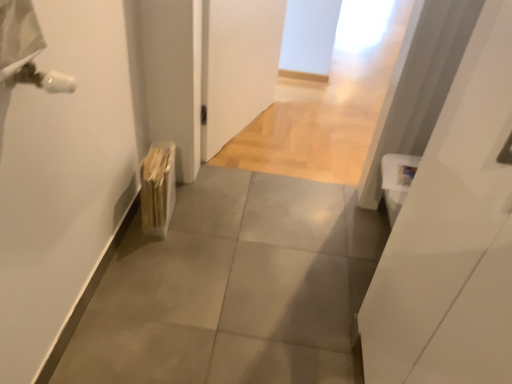
In order to click on wooden radiator at lower left in this screenshot , I will do `click(158, 189)`.

Describe the element at coordinates (234, 288) in the screenshot. I see `gray tile floor at center` at that location.

Identify the location of wooden radiator at lower left. This screenshot has height=384, width=512. pyautogui.click(x=158, y=189).

Is gray tile floor at center smaller than wooden radiator at lower left?

Incorrect, gray tile floor at center is not smaller in size than wooden radiator at lower left.

Considering the sizes of objects gray tile floor at center and wooden radiator at lower left in the image provided, who is thinner, gray tile floor at center or wooden radiator at lower left?

wooden radiator at lower left.

Based on the photo, is there a large distance between gray tile floor at center and wooden radiator at lower left?

They are positioned close to each other.

Considering the positions of objects gray tile floor at center and wooden radiator at lower left in the image provided, who is more to the right, gray tile floor at center or wooden radiator at lower left?

From the viewer's perspective, gray tile floor at center appears more on the right side.

Locate an element on the screen. This screenshot has height=384, width=512. door that is on the right side of wooden radiator at lower left is located at coordinates (453, 236).

Is white glossy door at right far from wooden radiator at lower left?

Absolutely, white glossy door at right is distant from wooden radiator at lower left.

Between point (435, 190) and point (165, 229), which one is positioned in front?

The point (435, 190) is closer.

From a real-world perspective, which object rests below the other?

wooden radiator at lower left, from a real-world perspective.

How much distance is there between gray tile floor at center and white glossy door at right?

The distance of gray tile floor at center from white glossy door at right is 23.75 inches.

Would you say gray tile floor at center is to the left or to the right of white glossy door at right in the picture?

In the image, gray tile floor at center appears on the left side of white glossy door at right.

Could you tell me if gray tile floor at center is facing white glossy door at right?

No, gray tile floor at center is not aimed at white glossy door at right.

From a real-world perspective, is gray tile floor at center physically located above or below white glossy door at right?

In terms of real-world spatial position, gray tile floor at center is below white glossy door at right.

Based on their positions, is wooden radiator at lower left located to the left or right of white glossy door at right?

Clearly, wooden radiator at lower left is on the left of white glossy door at right in the image.

From the picture: Can you confirm if wooden radiator at lower left is shorter than white glossy door at right?

Yes, wooden radiator at lower left is shorter than white glossy door at right.

Find the location of `door above the wooden radiator at lower left (from a real-world perspective)`. door above the wooden radiator at lower left (from a real-world perspective) is located at coordinates (x=453, y=236).

Is wooden radiator at lower left not inside white glossy door at right?

wooden radiator at lower left lies outside white glossy door at right's area.

Is wooden radiator at lower left in contact with gray tile floor at center?

No.

Where is `concrete below the wooden radiator at lower left (from a real-world perspective)`? concrete below the wooden radiator at lower left (from a real-world perspective) is located at coordinates (234, 288).

Do you think wooden radiator at lower left is within gray tile floor at center, or outside of it?

wooden radiator at lower left is spatially situated outside gray tile floor at center.

Does white glossy door at right have a smaller size compared to gray tile floor at center?

Yes, white glossy door at right is smaller than gray tile floor at center.

From a real-world perspective, who is located higher, white glossy door at right or gray tile floor at center?

From a 3D spatial view, white glossy door at right is above.

The image size is (512, 384). There is a gray tile floor at center. Identify the location of door above it (from a real-world perspective). (453, 236).

Between white glossy door at right and gray tile floor at center, which one has more height?

white glossy door at right.

The width and height of the screenshot is (512, 384). Identify the location of concrete that is below the wooden radiator at lower left (from the image's perspective). (234, 288).

At what (x,y) coordinates should I click in order to perform the action: click on door that appears above the wooden radiator at lower left (from a real-world perspective). Please return your answer as a coordinate pair (x, y). The image size is (512, 384). Looking at the image, I should click on (453, 236).

Estimate the real-world distances between objects in this image. Which object is closer to wooden radiator at lower left, gray tile floor at center or white glossy door at right?

gray tile floor at center lies closer to wooden radiator at lower left than the other object.

Looking at the image, which one is located further to gray tile floor at center, wooden radiator at lower left or white glossy door at right?

Among the two, white glossy door at right is located further to gray tile floor at center.

Considering their positions, is gray tile floor at center positioned closer to white glossy door at right than wooden radiator at lower left?

The object closer to white glossy door at right is gray tile floor at center.

From the image, which object appears to be farther from gray tile floor at center, white glossy door at right or wooden radiator at lower left?

Among the two, white glossy door at right is located further to gray tile floor at center.

Estimate the real-world distances between objects in this image. Which object is closer to white glossy door at right, wooden radiator at lower left or gray tile floor at center?

gray tile floor at center is positioned closer to the anchor white glossy door at right.

In the scene shown: Considering their positions, is white glossy door at right positioned further to wooden radiator at lower left than gray tile floor at center?

Based on the image, white glossy door at right appears to be further to wooden radiator at lower left.

At what (x,y) coordinates should I click in order to perform the action: click on concrete between white glossy door at right and wooden radiator at lower left in the front-back direction. Please return your answer as a coordinate pair (x, y). Looking at the image, I should click on (234, 288).